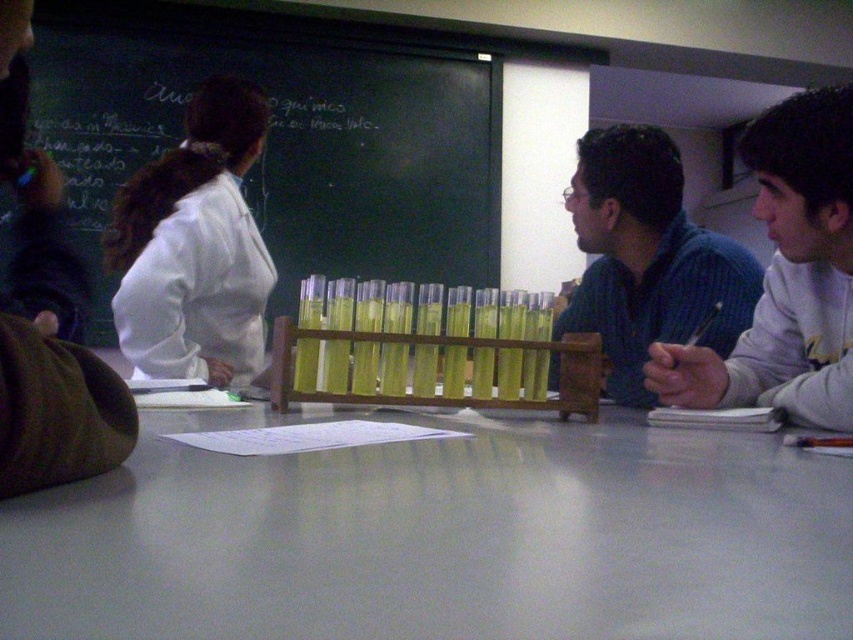
Consider the image. You are a student in the classroom and you want to reach for the transparent plastic test tubes at center without touching the white cotton shirt at right. Is this possible?

The transparent plastic test tubes at center are positioned over the white cotton shirt at right, so you can reach them without touching the shirt as they are above it.

From the picture: You are a student sitting at the back of the classroom. You need to hand in your assignment to the teacher who is standing near the white glossy table at center. However, there are transparent plastic test tubes at center blocking your path. Can you walk around them to reach the table?

The white glossy table at center is closer to the viewer than the transparent plastic test tubes at center, so you can walk around the transparent plastic test tubes at center to reach the white glossy table at center.